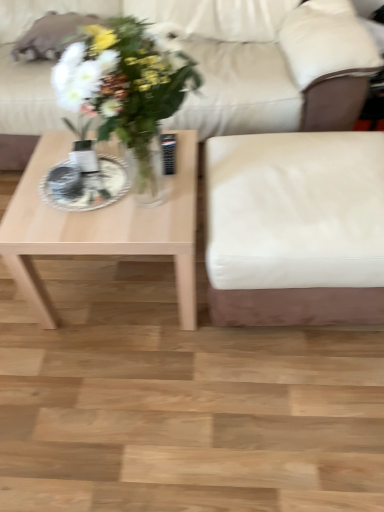
In order to click on vacant area that lies in front of white leather armchair at right in this screenshot , I will do `click(278, 406)`.